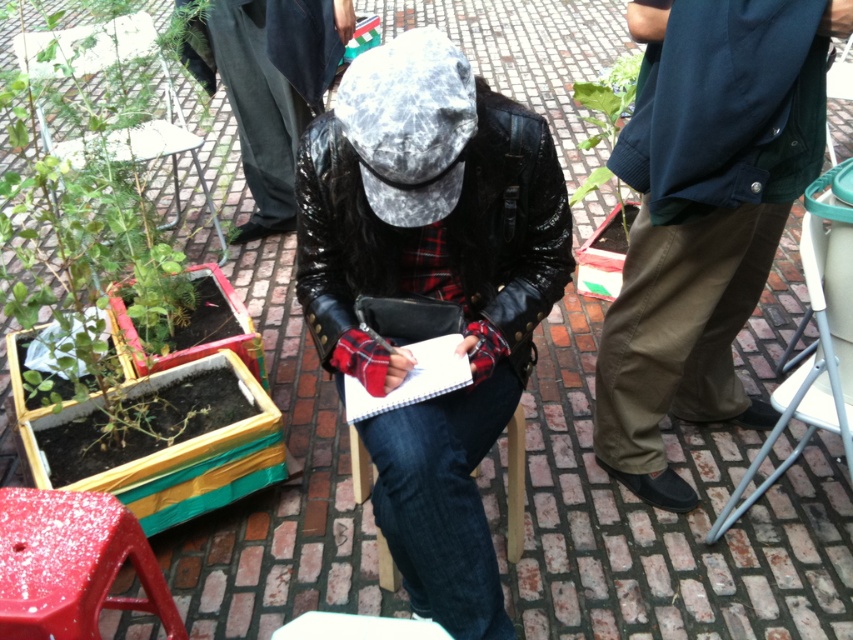
Question: Among these points, which one is farthest from the camera?

Choices:
 (A) [x=24, y=83]
 (B) [x=735, y=396]

Answer: (B)

Question: Observing the image, what is the correct spatial positioning of white paper at center in reference to green leafy plant at upper right?

Choices:
 (A) left
 (B) right

Answer: (A)

Question: Does dark green cotton pants at right have a larger size compared to white paper at center?

Choices:
 (A) no
 (B) yes

Answer: (B)

Question: Which object is farther from the camera taking this photo?

Choices:
 (A) dark green cotton pants at right
 (B) green leafy plant at upper right
 (C) leather jacket at center
 (D) white paper at center

Answer: (B)

Question: Can you confirm if smooth plastic stool at lower left is positioned to the right of white paper at center?

Choices:
 (A) no
 (B) yes

Answer: (A)

Question: Estimate the real-world distances between objects in this image. Which object is farther from the smooth plastic stool at lower left?

Choices:
 (A) metallic silver chair at right
 (B) leather jacket at center
 (C) green leafy plant at upper right

Answer: (C)